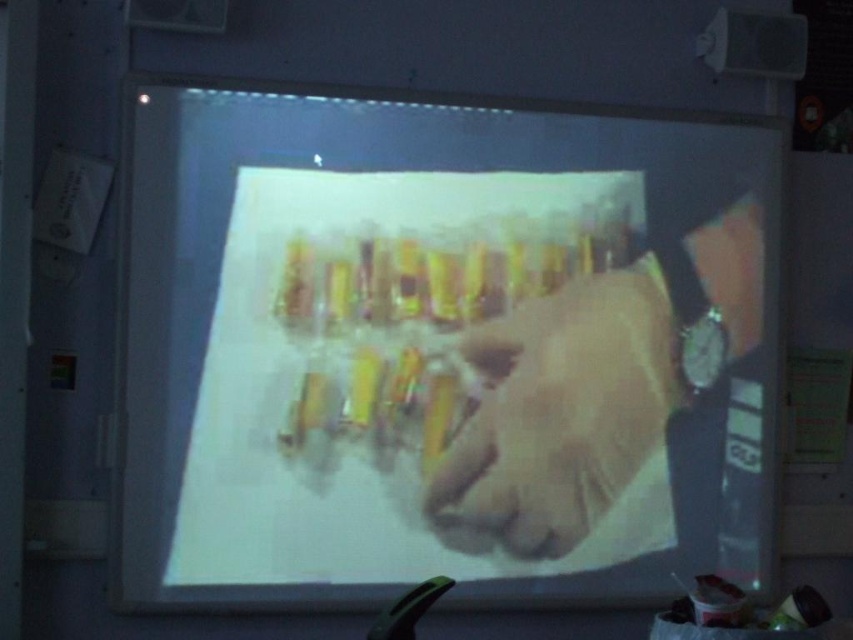
Question: Is matte plastic projector screen at center above smooth beige hand at center?

Choices:
 (A) no
 (B) yes

Answer: (B)

Question: Is matte plastic projector screen at center above smooth beige hand at center?

Choices:
 (A) yes
 (B) no

Answer: (A)

Question: Among these objects, which one is farthest from the camera?

Choices:
 (A) smooth beige hand at center
 (B) matte plastic projector screen at center

Answer: (A)

Question: Which of the following is the farthest from the observer?

Choices:
 (A) matte plastic projector screen at center
 (B) smooth beige hand at center

Answer: (B)

Question: Is matte plastic projector screen at center smaller than smooth beige hand at center?

Choices:
 (A) no
 (B) yes

Answer: (A)